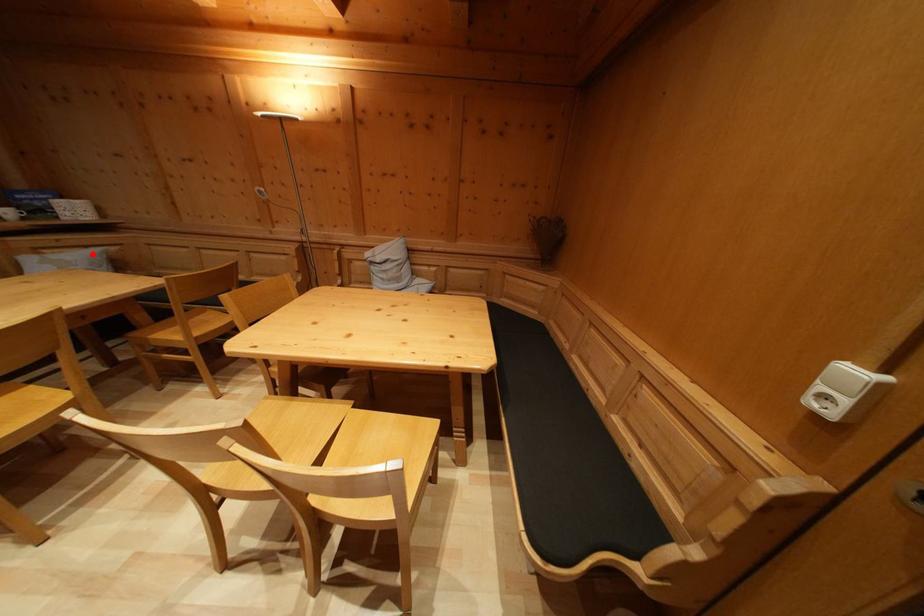
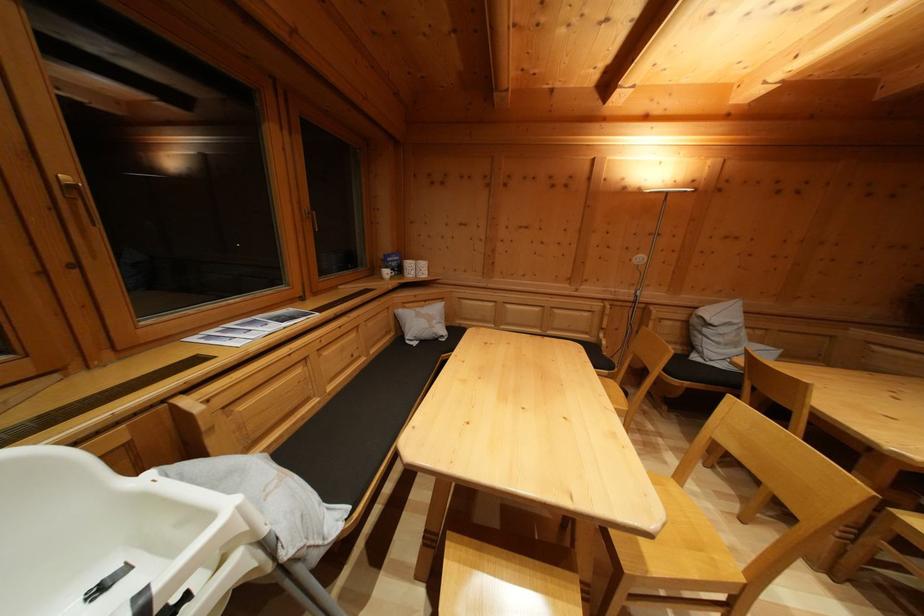
Where in the second image is the point corresponding to the highlighted location from the first image?

(431, 308)